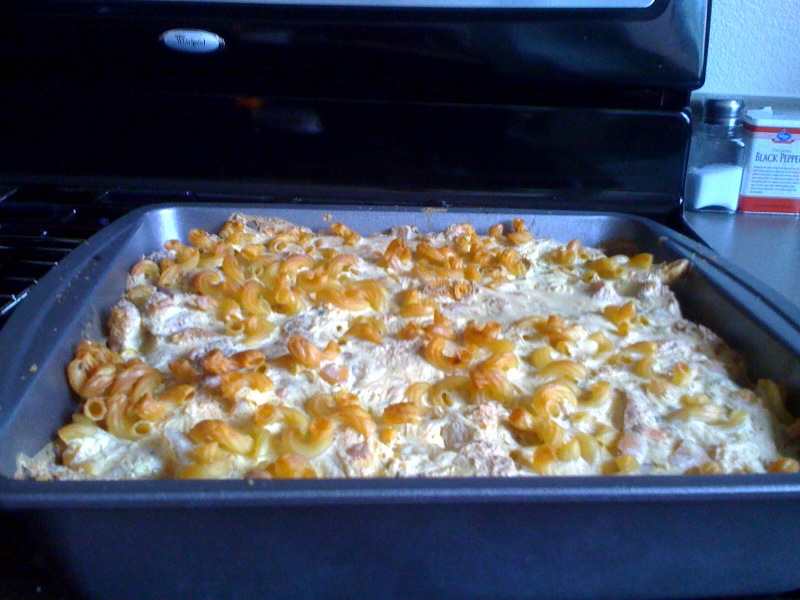
The height and width of the screenshot is (600, 800). I want to click on salt shaker, so click(717, 180).